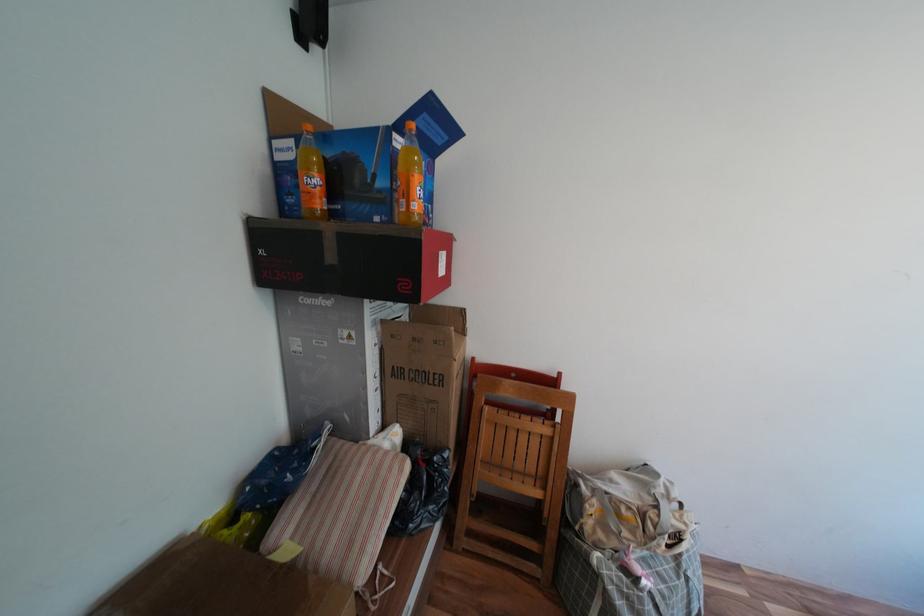
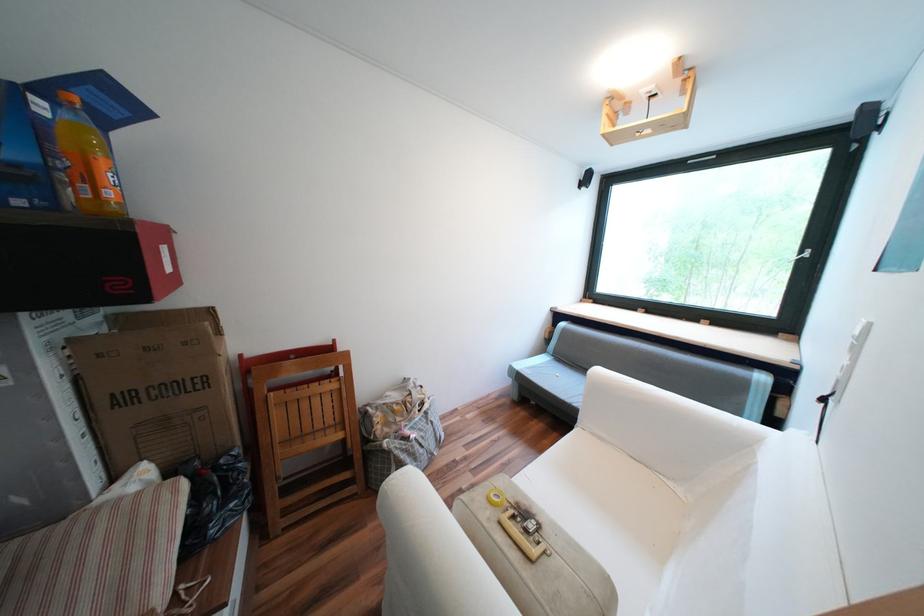
Where in the second image is the point corresponding to (x=538, y=418) from the first image?

(325, 383)